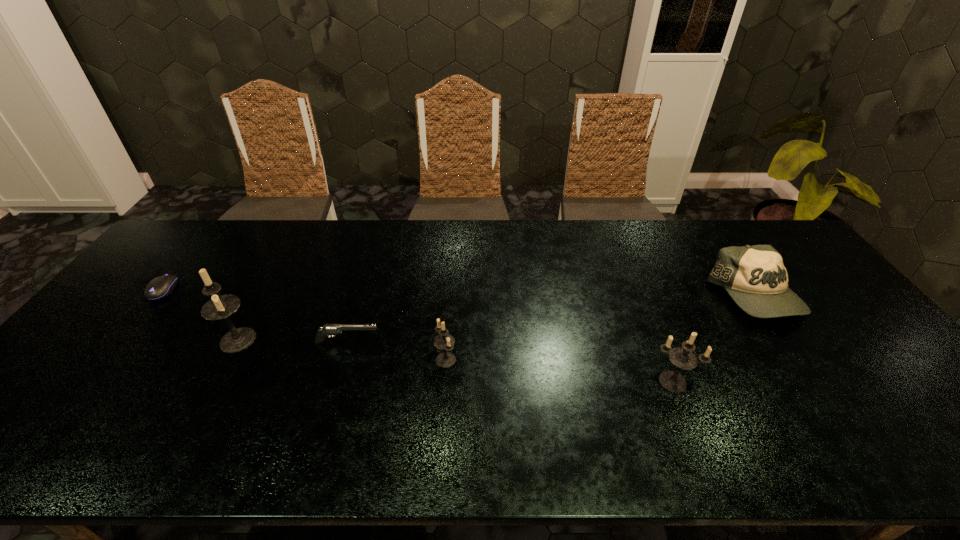
Where is `the leftmost candle holder`? Image resolution: width=960 pixels, height=540 pixels. the leftmost candle holder is located at coordinates (219, 307).

You are a GUI agent. You are given a task and a screenshot of the screen. Output one action in this format:
    pyautogui.click(x=<x>, y=<y>)
    Task: Click on the tallest candle holder
    The width and height of the screenshot is (960, 540).
    Given the screenshot: What is the action you would take?
    pyautogui.click(x=219, y=307)

The height and width of the screenshot is (540, 960). I want to click on the second candle holder from right to left, so click(x=444, y=341).

At what (x,y) coordinates should I click in order to perform the action: click on the fourth shortest object. Please return your answer as a coordinate pair (x, y). Looking at the image, I should click on (444, 341).

Where is `the second tallest candle holder`? The height and width of the screenshot is (540, 960). the second tallest candle holder is located at coordinates (682, 357).

The height and width of the screenshot is (540, 960). I want to click on the rightmost candle holder, so click(682, 357).

This screenshot has height=540, width=960. I want to click on the shortest object, so click(x=160, y=287).

Locate an element on the screen. Image resolution: width=960 pixels, height=540 pixels. the leftmost object is located at coordinates (160, 287).

This screenshot has height=540, width=960. What are the coordinates of `the second shortest object` in the screenshot? It's located at (330, 329).

Where is `pistol`? The width and height of the screenshot is (960, 540). pistol is located at coordinates (330, 329).